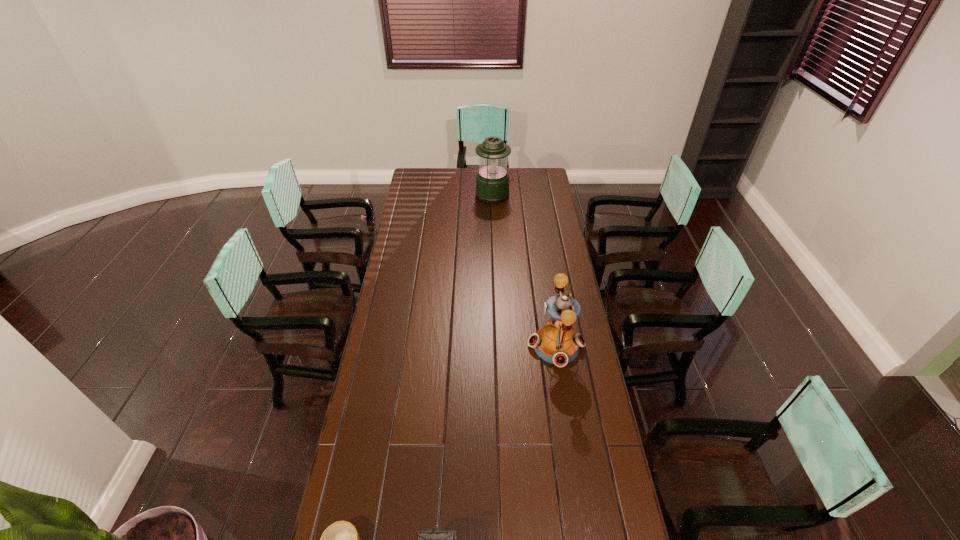
Where is `free space at the right edge of the desktop`? free space at the right edge of the desktop is located at coordinates (586, 395).

The height and width of the screenshot is (540, 960). Find the location of `vacant space at the far right corner of the desktop`. vacant space at the far right corner of the desktop is located at coordinates (529, 180).

Where is `free spot between the farthest object and the third shortest object`? free spot between the farthest object and the third shortest object is located at coordinates (525, 271).

Locate an element on the screen. object that is the closest to the leftmost lantern is located at coordinates (341, 539).

You are a GUI agent. You are given a task and a screenshot of the screen. Output one action in this format:
    pyautogui.click(x=<x>, y=<y>)
    Task: Click on the object that is the third closest to the farthest lantern
    
    Given the screenshot: What is the action you would take?
    pyautogui.click(x=428, y=539)

Select which lantern is the second closest to the shortest object. Please provide its 2D coordinates. Your answer should be formatted as a tuple, i.e. [(x, y)], where the tuple contains the x and y coordinates of a point satisfying the conditions above.

[(556, 342)]

The height and width of the screenshot is (540, 960). Identify the location of lantern identified as the closest to the third tallest object. (556, 342).